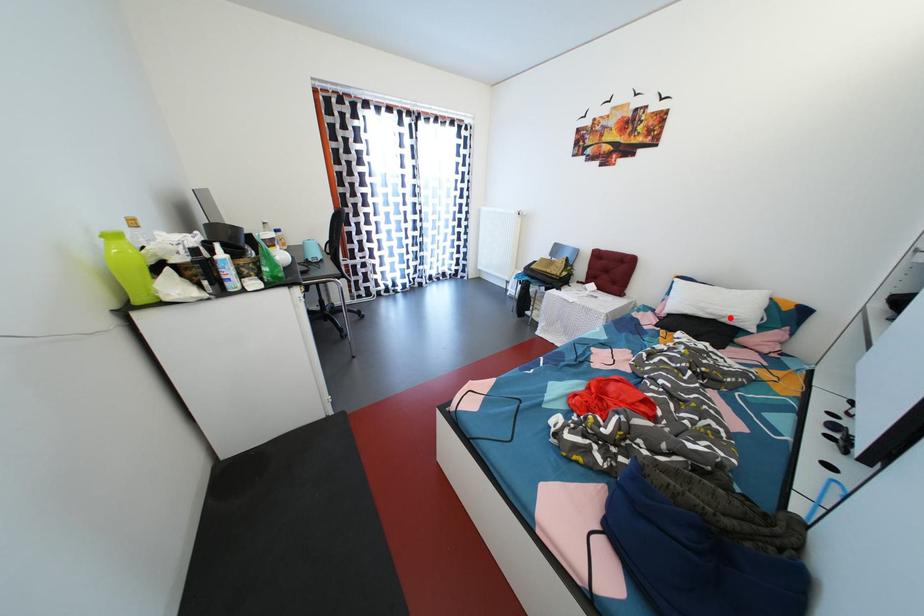
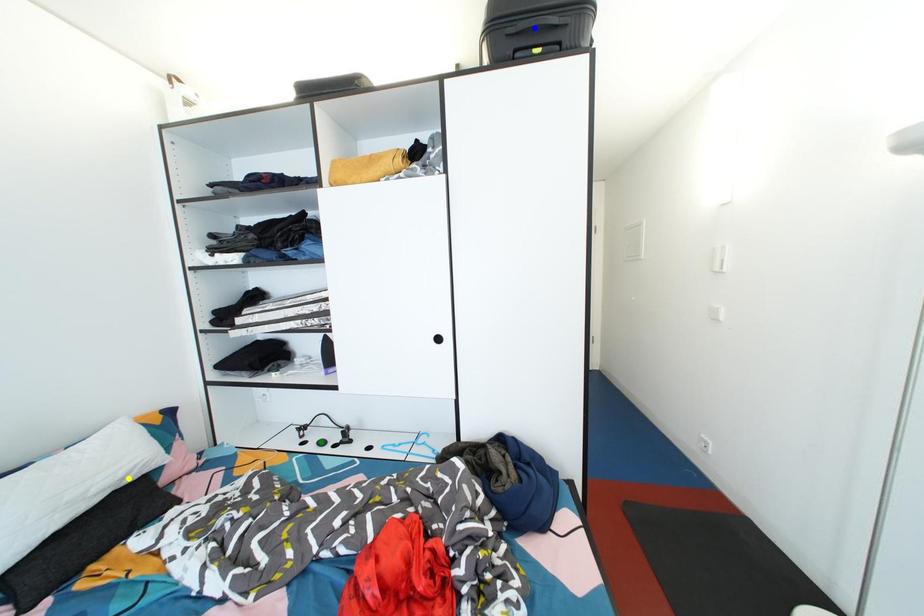
Question: I am providing you with two images of the same scene from different viewpoints. A red point is marked on the first image. You are given multiple points on the second image. Which mark in image 2 goes with the point in image 1?

Choices:
 (A) yellow point
 (B) blue point
 (C) green point

Answer: (A)